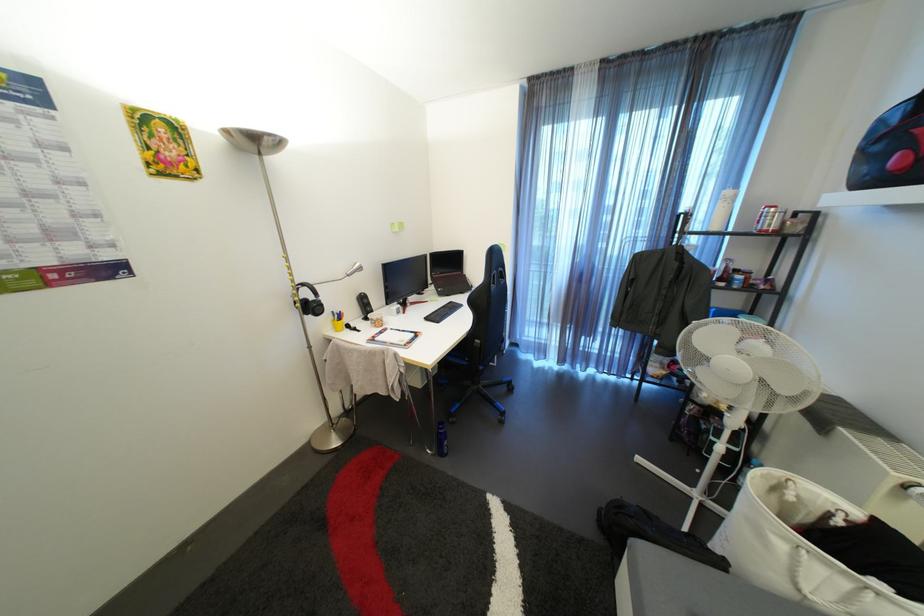
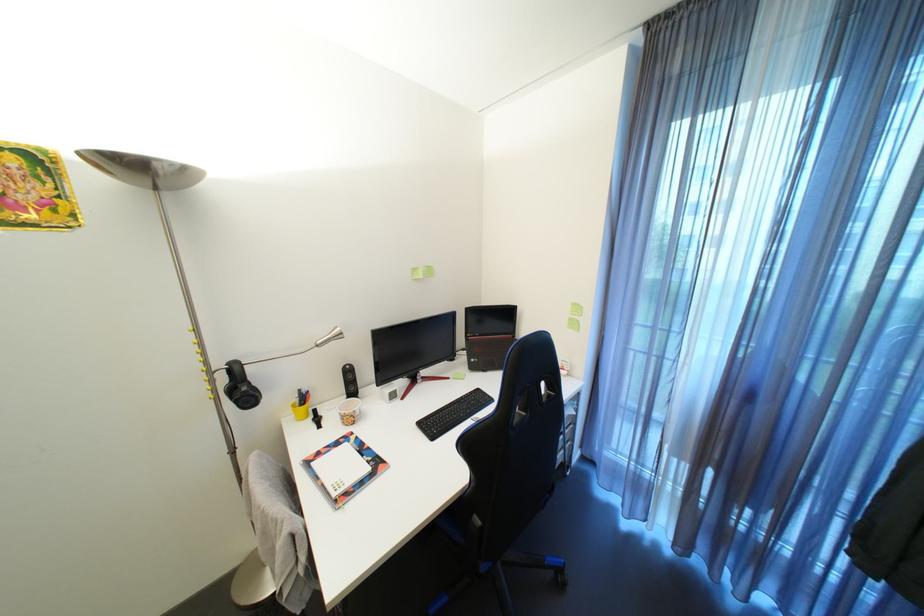
Question: What movement of the cameraman would produce the second image?

Choices:
 (A) Left
 (B) Right
 (C) Forward
 (D) Backward

Answer: (C)